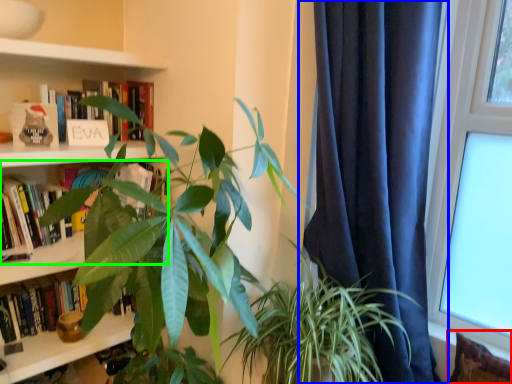
Question: Which object is the farthest from pillow (highlighted by a red box)? Choose among these: curtain (highlighted by a blue box) or book (highlighted by a green box).

Choices:
 (A) curtain
 (B) book

Answer: (B)